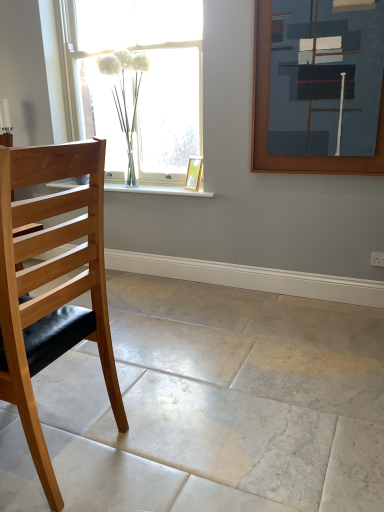
The height and width of the screenshot is (512, 384). What are the coordinates of `free point below brown wooden picture frame at upper right, the 2th picture frame in the left-to-right sequence (from a real-world perspective)` in the screenshot? It's located at (312, 301).